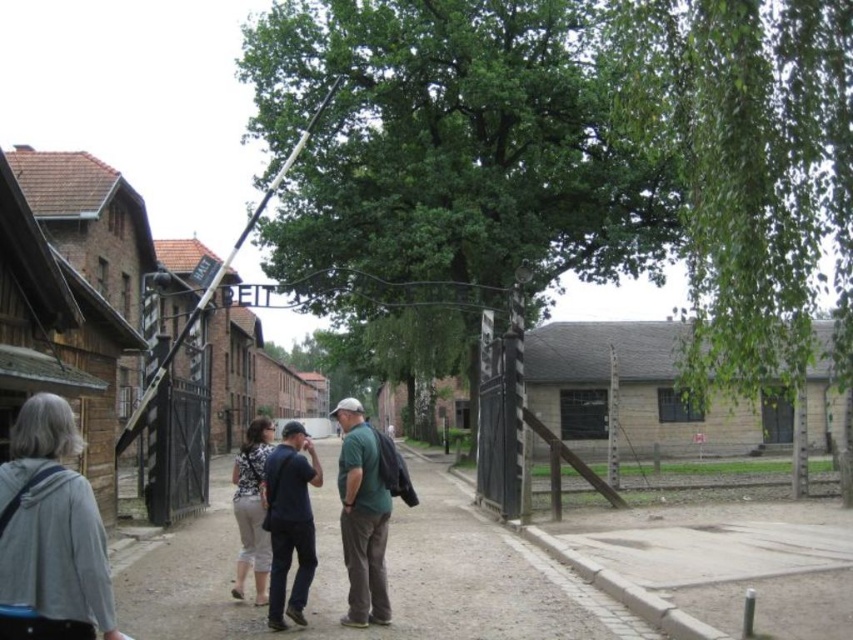
Question: Among these objects, which one is farthest from the camera?

Choices:
 (A) green matte shirt at center
 (B) gray fabric jacket at lower left

Answer: (A)

Question: Which object is the farthest from the brown dirt alley at center?

Choices:
 (A) green matte shirt at center
 (B) gray fabric jacket at lower left
 (C) dark blue jeans at center

Answer: (B)

Question: Can you confirm if brown dirt alley at center is wider than green matte shirt at center?

Choices:
 (A) no
 (B) yes

Answer: (B)

Question: Is dark blue jeans at center below printed fabric pants at center?

Choices:
 (A) no
 (B) yes

Answer: (A)

Question: Which of the following is the closest to the observer?

Choices:
 (A) dark blue jeans at center
 (B) green matte shirt at center

Answer: (A)

Question: Is gray fabric jacket at lower left to the left of green matte shirt at center from the viewer's perspective?

Choices:
 (A) yes
 (B) no

Answer: (A)